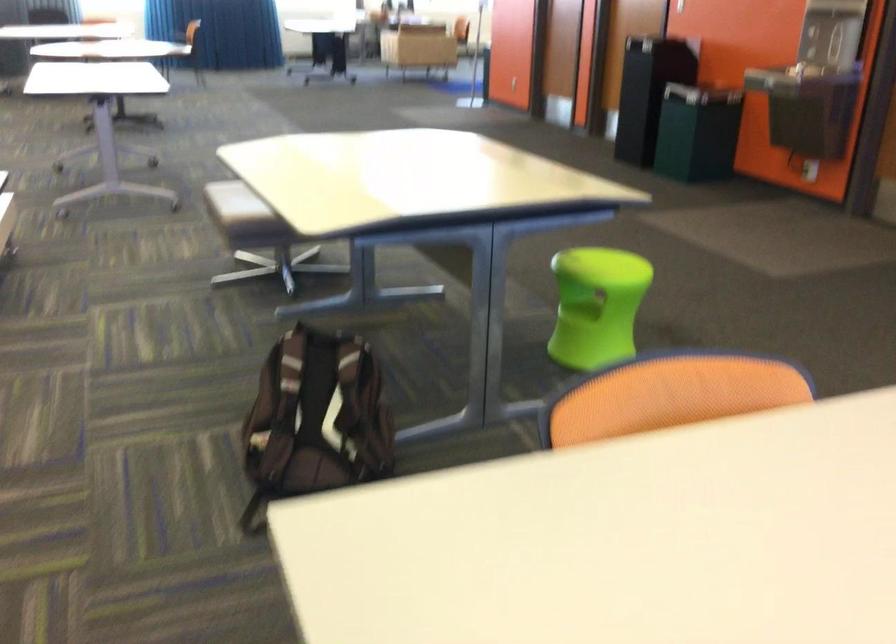
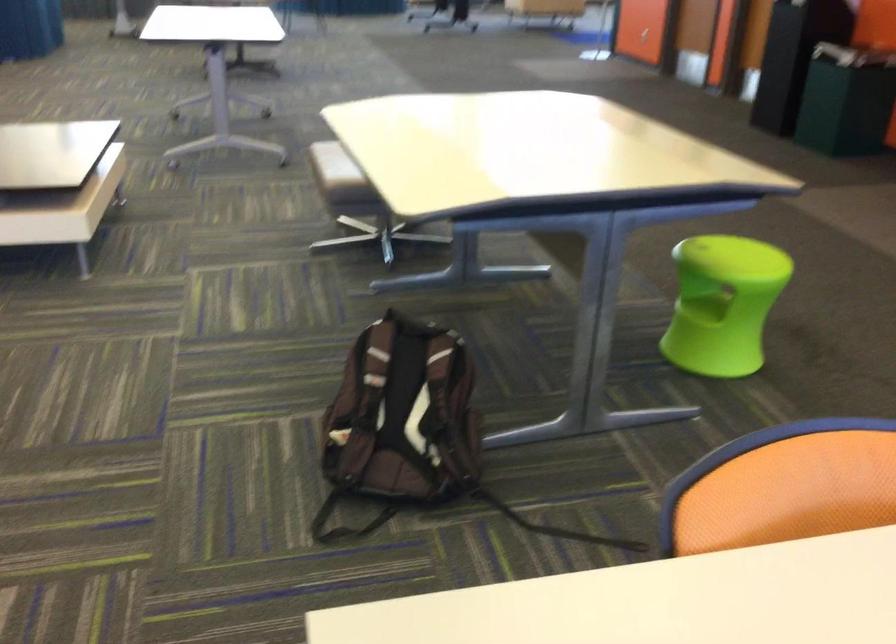
Where in the second image is the point corresponding to the point at 581,314 from the first image?

(702, 307)